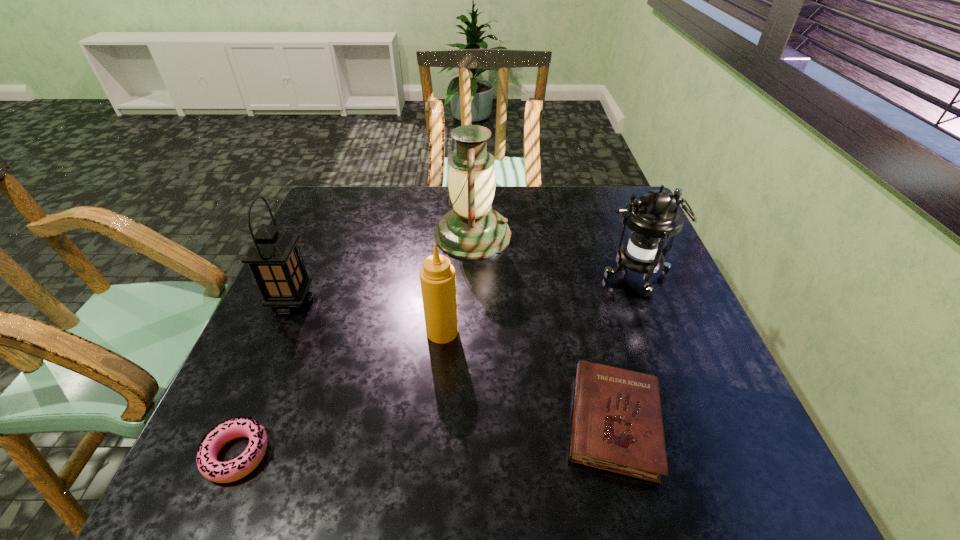
The height and width of the screenshot is (540, 960). In order to click on object that is at the near right corner in this screenshot , I will do point(617,426).

The width and height of the screenshot is (960, 540). I want to click on free space at the far edge, so click(559, 201).

In the image, there is a desktop. Where is `vacant space at the left edge`? The height and width of the screenshot is (540, 960). vacant space at the left edge is located at coordinates (306, 319).

Where is `free region at the right edge`? free region at the right edge is located at coordinates (637, 313).

This screenshot has width=960, height=540. Identify the location of vacant region at the far left corner of the desktop. (347, 208).

Identify the location of empty space between the shortest object and the second lantern from right to left. (355, 345).

Where is `unoccupied area between the hardback book and the rightmost lantern`? This screenshot has width=960, height=540. unoccupied area between the hardback book and the rightmost lantern is located at coordinates (624, 350).

I want to click on unoccupied position between the shortest object and the fourth farthest object, so click(340, 393).

At what (x,y) coordinates should I click in order to perform the action: click on vacant point located between the rightmost lantern and the doughnut. Please return your answer as a coordinate pair (x, y). This screenshot has height=540, width=960. Looking at the image, I should click on (436, 366).

Find the location of `empty space between the second lantern from left to right and the leftmost lantern`. empty space between the second lantern from left to right and the leftmost lantern is located at coordinates (382, 268).